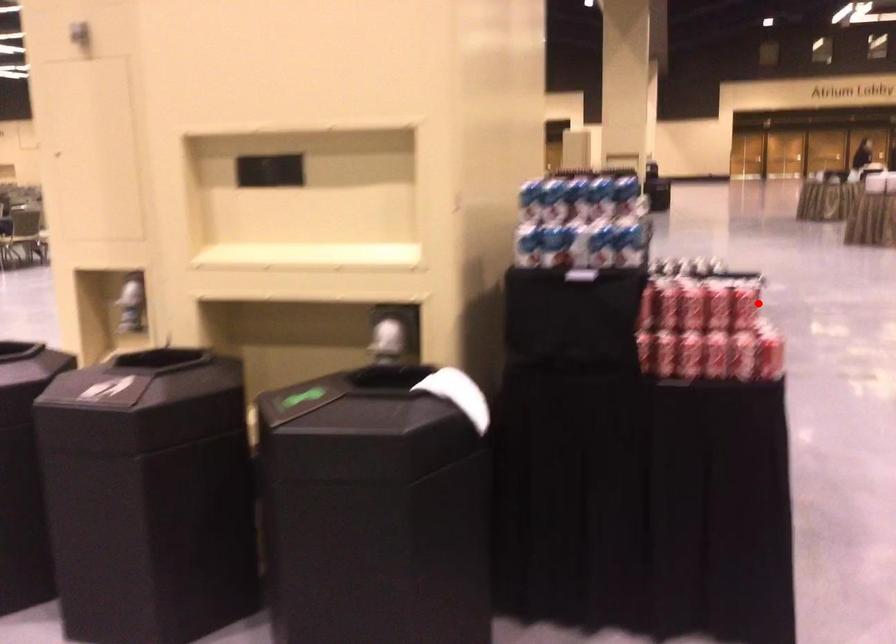
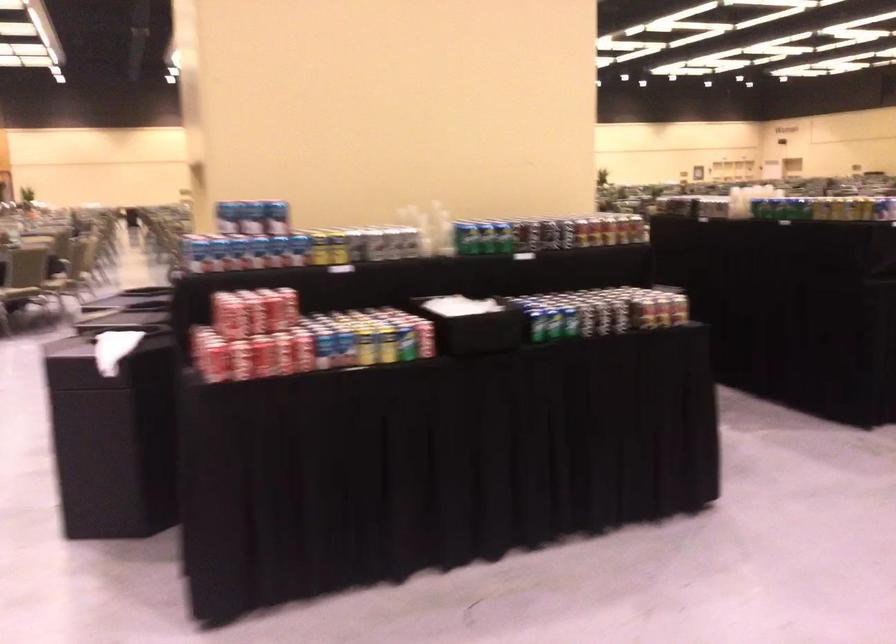
Locate, in the second image, the point that corresponds to the highlighted location in the first image.

(227, 315)